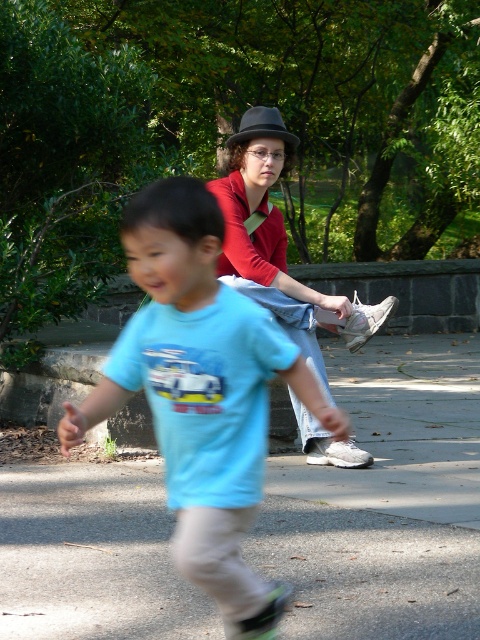
Question: Which object is farther from the camera taking this photo?

Choices:
 (A) gray concrete pavement at center
 (B) matte red shirt at center
 (C) black felt hat at upper center
 (D) light blue t-shirt at center

Answer: (C)

Question: Which is farther from the matte red shirt at center?

Choices:
 (A) light blue t-shirt at center
 (B) black felt hat at upper center

Answer: (A)

Question: Which point is farther to the camera?

Choices:
 (A) black felt hat at upper center
 (B) gray concrete pavement at center
 (C) matte red shirt at center

Answer: (A)

Question: Does gray concrete pavement at center appear over light blue t-shirt at center?

Choices:
 (A) yes
 (B) no

Answer: (B)

Question: Does gray concrete pavement at center appear under matte red shirt at center?

Choices:
 (A) no
 (B) yes

Answer: (B)

Question: Does gray concrete pavement at center appear on the right side of light blue t-shirt at center?

Choices:
 (A) no
 (B) yes

Answer: (B)